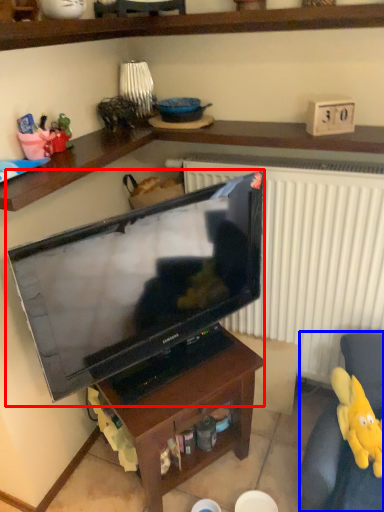
Question: Which of the following is the closest to the observer, television (highlighted by a red box) or swivel chair (highlighted by a blue box)?

Choices:
 (A) television
 (B) swivel chair

Answer: (A)